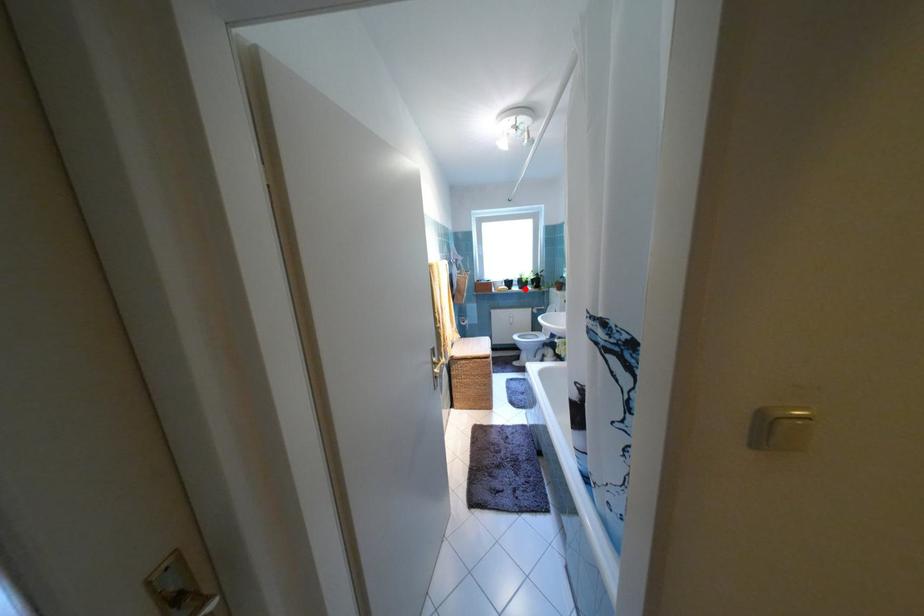
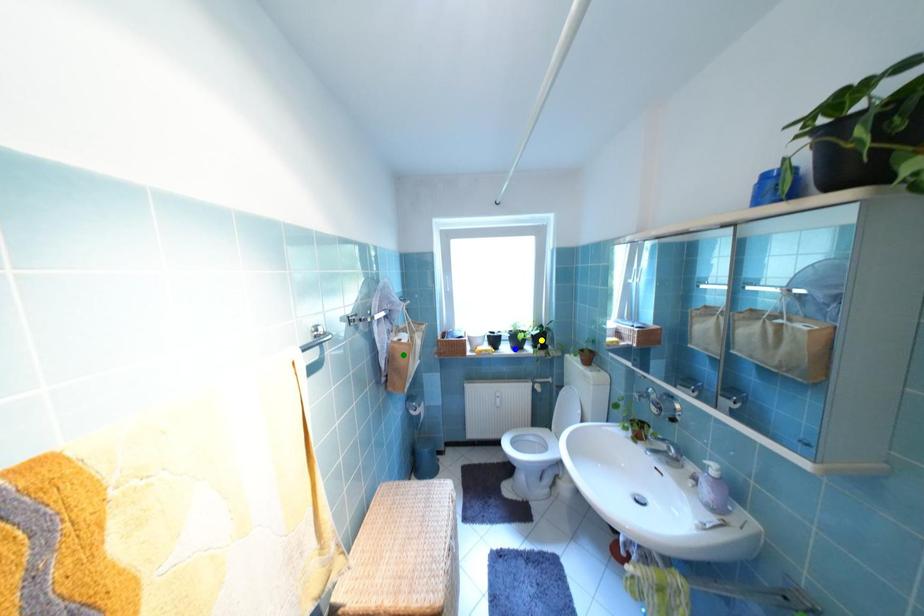
Question: I am providing you with two images of the same scene from different viewpoints. A red point is marked on the first image. You are given multiple points on the second image. Can you choose the point in image 2 that corresponds to the point in image 1?

Choices:
 (A) yellow point
 (B) blue point
 (C) green point

Answer: (B)